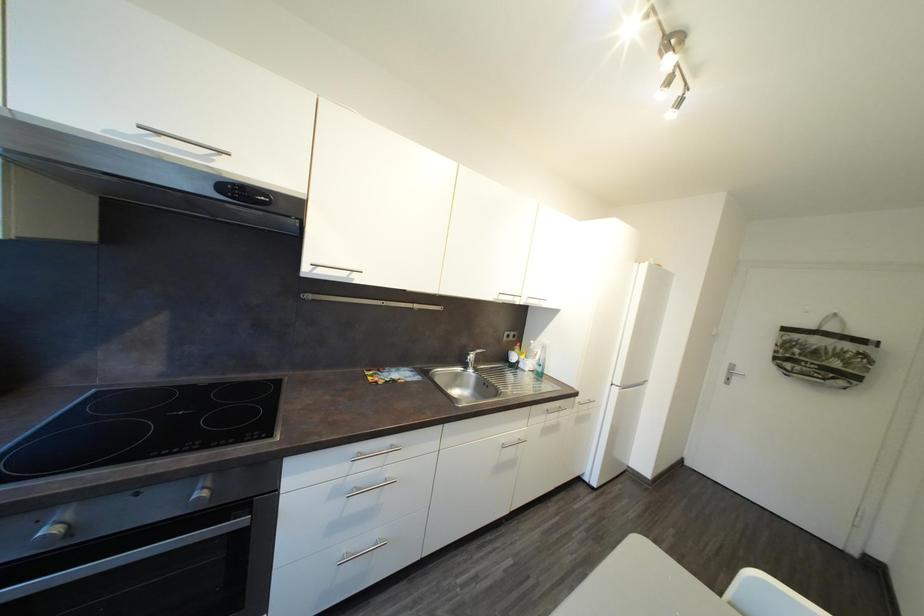
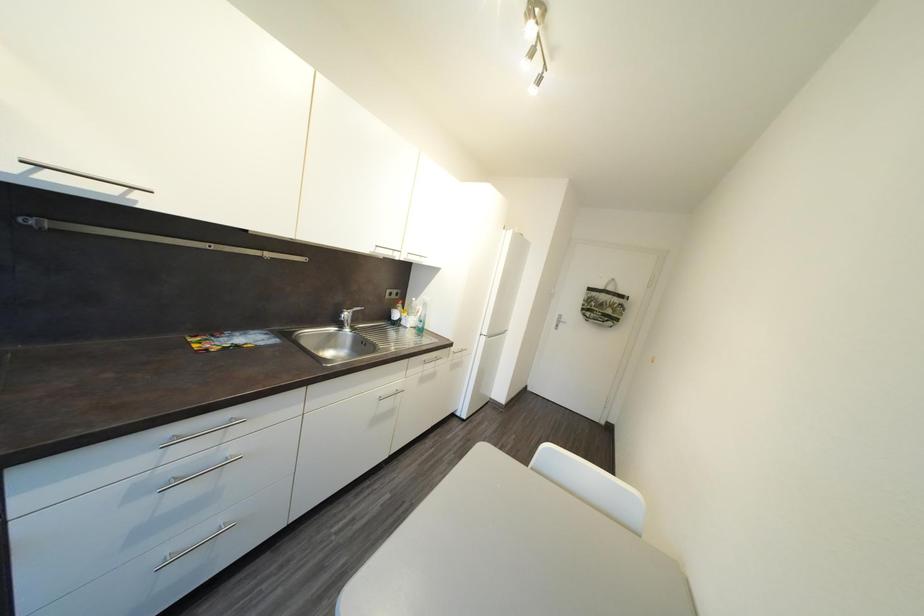
Question: Which direction would the cameraman need to move to produce the second image? Reply with the corresponding letter.

Choices:
 (A) Left
 (B) Right
 (C) Forward
 (D) Backward

Answer: (B)